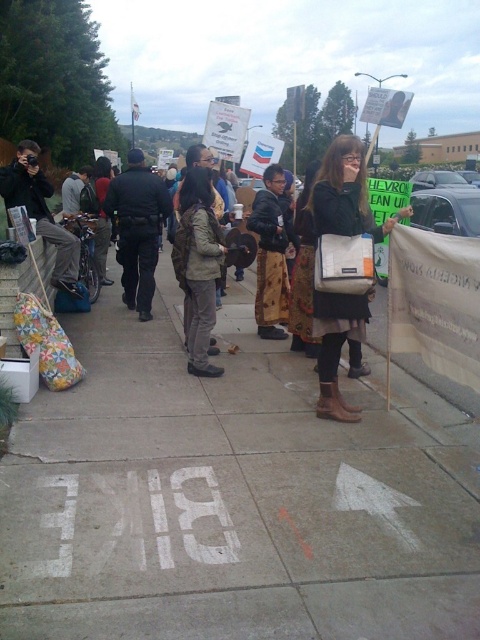
Is white concrete sidewalk at center above dark brown leather jacket at center?

No.

Can you confirm if white concrete sidewalk at center is thinner than dark brown leather jacket at center?

No.

You are a GUI agent. You are given a task and a screenshot of the screen. Output one action in this format:
    pyautogui.click(x=<x>, y=<y>)
    Task: Click on the white concrete sidewalk at center
    
    Given the screenshot: What is the action you would take?
    pyautogui.click(x=231, y=499)

Which is in front, point (322, 225) or point (331, 324)?

Point (322, 225) is more forward.

Is the position of dark brown leather jacket at center less distant than that of brown leather boots at center?

No, it is behind brown leather boots at center.

Between point (201, 371) and point (346, 225), which one is positioned in front?

Point (346, 225) is in front.

You are a GUI agent. You are given a task and a screenshot of the screen. Output one action in this format:
    pyautogui.click(x=<x>, y=<y>)
    Task: Click on the dark brown leather jacket at center
    
    Given the screenshot: What is the action you would take?
    pyautogui.click(x=340, y=196)

Locate an element on the screen. The width and height of the screenshot is (480, 640). white concrete sidewalk at center is located at coordinates (231, 499).

Where is `white concrete sidewalk at center`? This screenshot has height=640, width=480. white concrete sidewalk at center is located at coordinates (231, 499).